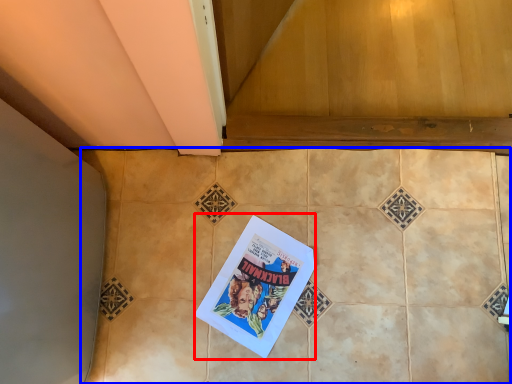
Question: Which object appears farthest to the camera in this image, comic book (highlighted by a red box) or ceramic tile (highlighted by a blue box)?

Choices:
 (A) comic book
 (B) ceramic tile

Answer: (A)